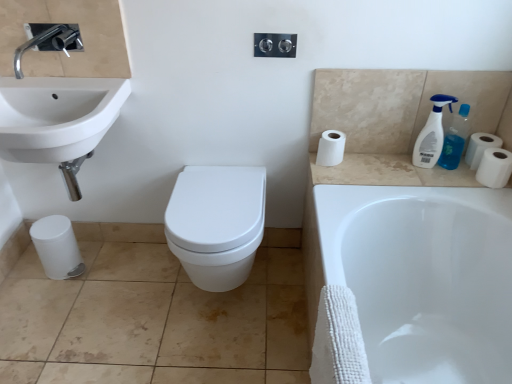
Identify the location of free space to the left of white matte toilet paper at lower left, which appears as the 1th toilet paper when viewed from the left. (23, 273).